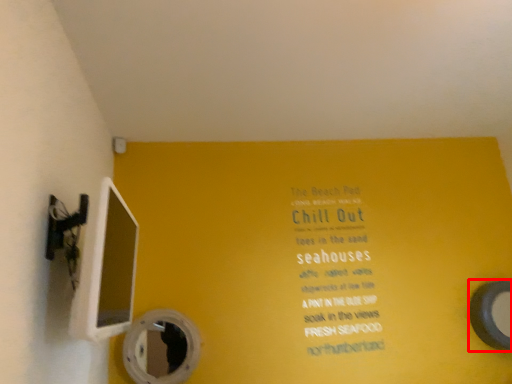
Question: In this image, where is mirror (annotated by the red box) located relative to mirror?

Choices:
 (A) left
 (B) right

Answer: (B)